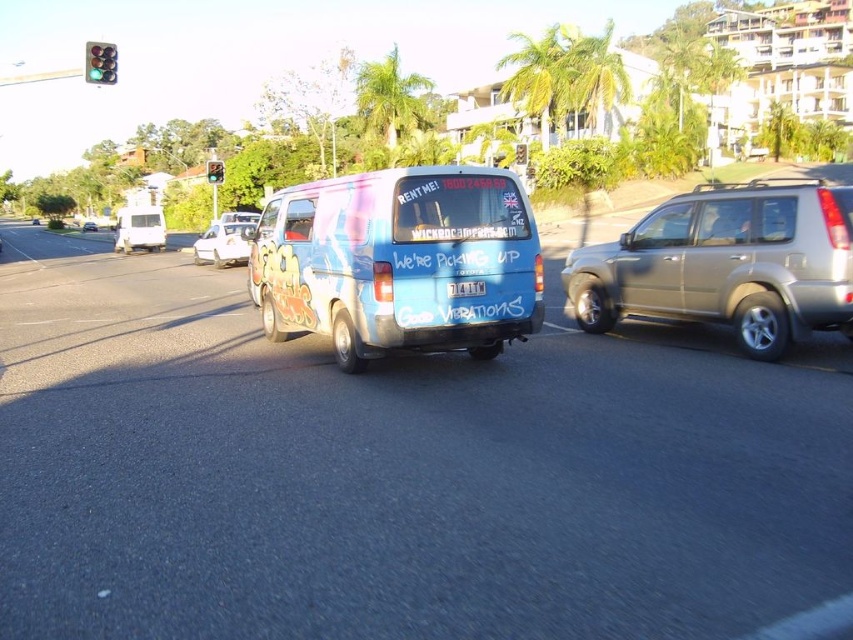
In the scene shown: You are a pedestrian standing at the intersection and see the metallic glass traffic light at upper left and the green glass traffic light at upper left. Which one is closer to you?

The metallic glass traffic light at upper left is closer to the viewer than the green glass traffic light at upper left.

You are a delivery driver who needs to confirm the license plate number of the blue painted van at center. However, you notice the white plastic license plate at rear is partially obstructed by the van itself. Can you still see the entire license plate number?

The blue painted van at center is positioned over white plastic license plate at rear, so the license plate number is partially obstructed and cannot be seen in full.

You are a pedestrian standing on the sidewalk and want to cross the street. You see the blue painted van at center and the metallic glass traffic light at upper left. Which object is closer to the ground?

The blue painted van at center is closer to the ground because it is located below the metallic glass traffic light at upper left.